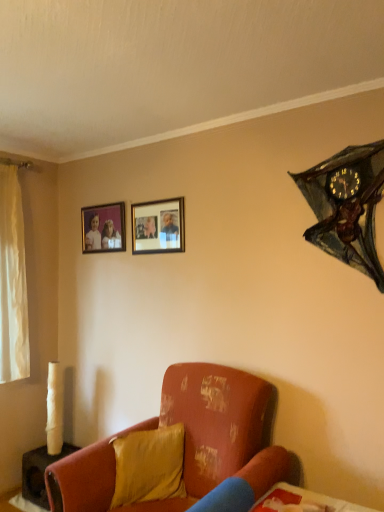
Question: Is matte wooden picture frame at upper left, positioned as the 1th picture frame in left-to-right order, in front of or behind matte black picture frame at upper center, which is the second picture frame in back-to-front order, in the image?

Choices:
 (A) behind
 (B) front

Answer: (A)

Question: In terms of size, does matte wooden picture frame at upper left, the second picture frame positioned from the front, appear bigger or smaller than matte black picture frame at upper center, arranged as the 2th picture frame when viewed from the left?

Choices:
 (A) big
 (B) small

Answer: (A)

Question: Based on their relative distances, which object is nearer to the matte wooden picture frame at upper left, which is the second picture frame from right to left?

Choices:
 (A) satin yellow pillow at lower center
 (B) distressed orange fabric couch at lower center
 (C) metallic bat-shaped clock at upper right
 (D) matte black picture frame at upper center, acting as the 1th picture frame starting from the front

Answer: (D)

Question: Estimate the real-world distances between objects in this image. Which object is closer to the satin yellow pillow at lower center?

Choices:
 (A) distressed orange fabric couch at lower center
 (B) metallic bat-shaped clock at upper right
 (C) matte wooden picture frame at upper left, the second picture frame positioned from the front
 (D) matte black picture frame at upper center, which is the second picture frame in back-to-front order

Answer: (A)